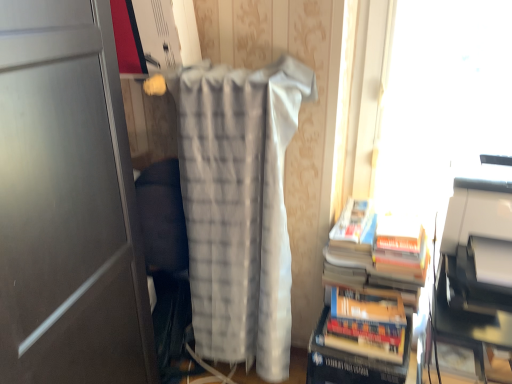
Question: Would you say hardcover books at right is to the left or to the right of white plastic printer at right in the picture?

Choices:
 (A) right
 (B) left

Answer: (B)

Question: From the image's perspective, is hardcover books at right located above or below white plastic printer at right?

Choices:
 (A) below
 (B) above

Answer: (A)

Question: Estimate the real-world distances between objects in this image. Which object is farther from the white textured blanket at center?

Choices:
 (A) transparent plastic window screen at upper right
 (B) hardcover book at lower right
 (C) hardcover books at right
 (D) white plastic printer at right

Answer: (A)

Question: Based on their relative distances, which object is farther from the hardcover book at lower right?

Choices:
 (A) transparent plastic window screen at upper right
 (B) white textured blanket at center
 (C) hardcover books at right
 (D) white plastic printer at right

Answer: (A)